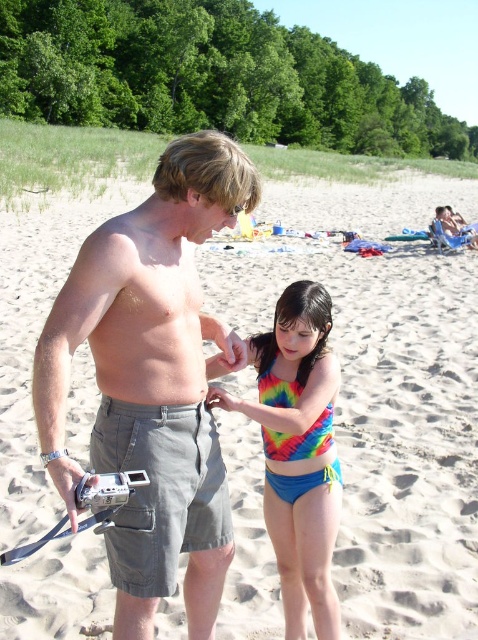
Who is shorter, gray cotton shorts at center or tie-dye fabric bikini at center?

Standing shorter between the two is tie-dye fabric bikini at center.

Looking at this image, which is more to the right, gray cotton shorts at center or tie-dye fabric bikini at center?

tie-dye fabric bikini at center is more to the right.

I want to click on gray cotton shorts at center, so click(152, 381).

Locate an element on the screen. gray cotton shorts at center is located at coordinates (152, 381).

Which is behind, point (227, 138) or point (280, 476)?

The point (227, 138) is more distant.

In the scene shown: Between gray cotton shorts at center and rainbow tie-dye bikini bottom at center, which one is positioned higher?

gray cotton shorts at center is higher up.

Between point (95, 280) and point (311, 481), which one is positioned behind?

Point (311, 481)

This screenshot has width=478, height=640. In order to click on gray cotton shorts at center in this screenshot , I will do `click(152, 381)`.

This screenshot has height=640, width=478. Find the location of `sandy beach at center`. sandy beach at center is located at coordinates (387, 420).

Can you confirm if sandy beach at center is taller than rainbow tie-dye bikini bottom at center?

Yes, sandy beach at center is taller than rainbow tie-dye bikini bottom at center.

Describe the element at coordinates (387, 420) in the screenshot. I see `sandy beach at center` at that location.

Locate an element on the screen. sandy beach at center is located at coordinates (387, 420).